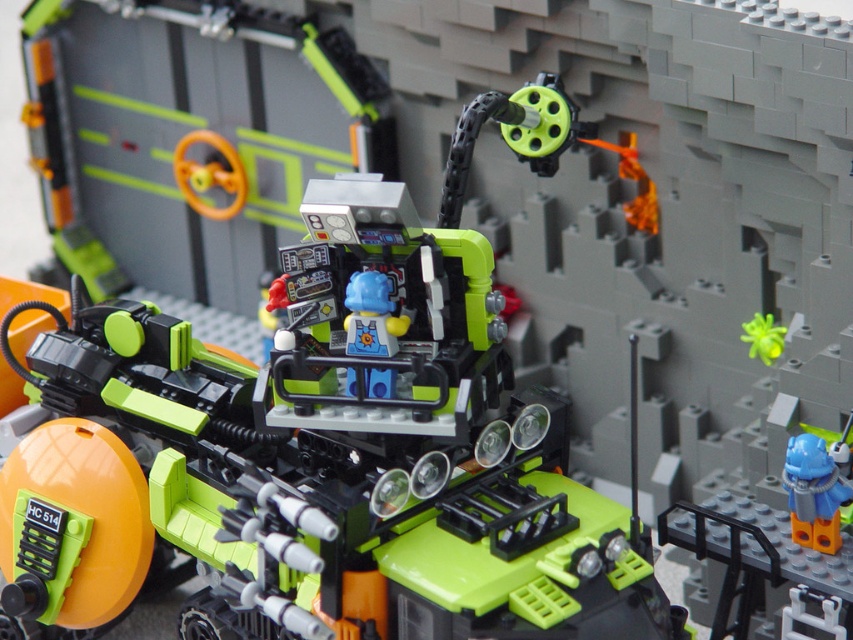
You are a LEGO designer trying to fit a blue matte helmet at center onto the green matte vehicle at center. The helmet must be placed in a position where it doesn not exceed the vehicle width. Can the helmet be placed without overhanging the edges?

The green matte vehicle at center is wider than the blue matte helmet at center, so the helmet can be placed without overhanging the edges as its width is smaller.

You are a LEGO builder trying to place a blue matte helmet at center on top of the green matte vehicle at center. Based on the size of the helmet and the vehicle, will the helmet fit securely on top without falling off?

The green matte vehicle at center is bigger than the blue matte helmet at center, so the helmet will fit securely on top without falling off.